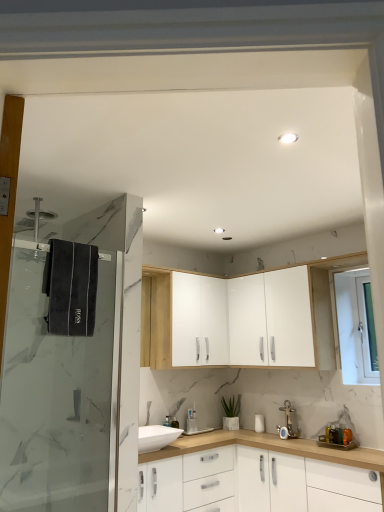
Identify the location of vacant point to the right of white glossy light fixture at upper center. (328, 138).